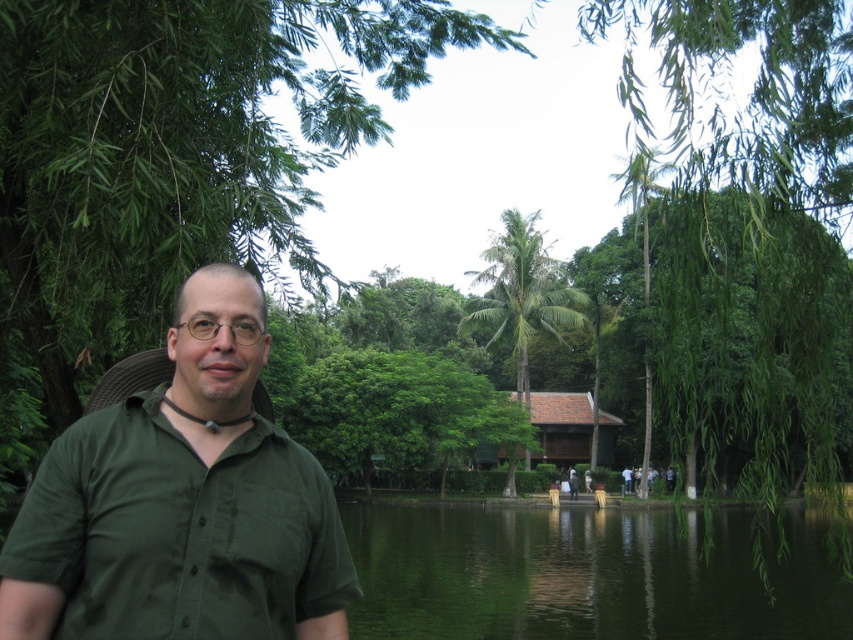
Is green matte shirt at center in front of green leafy palm tree at center?

That is True.

This screenshot has width=853, height=640. Describe the element at coordinates (183, 504) in the screenshot. I see `green matte shirt at center` at that location.

Locate an element on the screen. The height and width of the screenshot is (640, 853). green matte shirt at center is located at coordinates (183, 504).

This screenshot has height=640, width=853. Find the location of `green matte shirt at center`. green matte shirt at center is located at coordinates (183, 504).

Between green matte shirt at center and green reflective water at center, which one is positioned higher?

green matte shirt at center is above.

Is green matte shirt at center thinner than green reflective water at center?

Yes, green matte shirt at center is thinner than green reflective water at center.

Who is more distant from viewer, [160,433] or [399,506]?

Positioned behind is point [399,506].

Find the location of a particular element. green matte shirt at center is located at coordinates (183, 504).

Can you confirm if green leafy tree at upper left is shorter than green leafy palm tree at center?

In fact, green leafy tree at upper left may be taller than green leafy palm tree at center.

Looking at this image, does green leafy tree at upper left have a lesser width compared to green leafy palm tree at center?

No.

Does point (142, 88) come behind point (561, 321)?

No, it is in front of (561, 321).

Where is `green leafy tree at upper left`? Image resolution: width=853 pixels, height=640 pixels. green leafy tree at upper left is located at coordinates (170, 163).